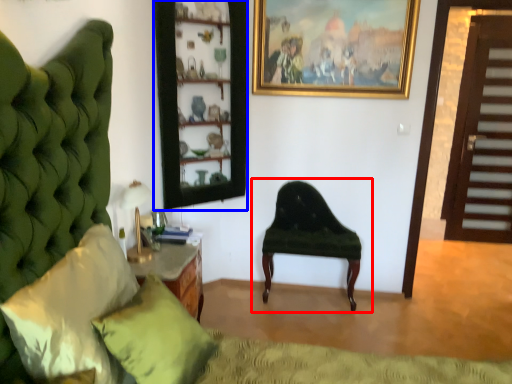
Question: Which object appears closest to the camera in this image, chair (highlighted by a red box) or shelf (highlighted by a blue box)?

Choices:
 (A) chair
 (B) shelf

Answer: (B)